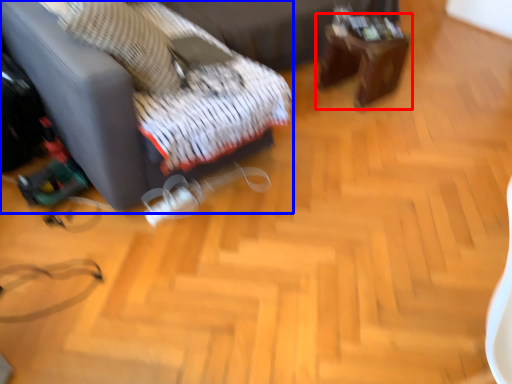
Question: Among these objects, which one is farthest to the camera, table (highlighted by a red box) or furniture (highlighted by a blue box)?

Choices:
 (A) table
 (B) furniture

Answer: (A)